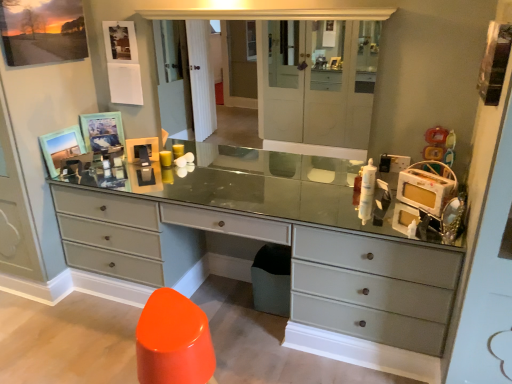
Question: Is plastic yellow toy at upper right with wooden picture frame at upper left, which is the second picture frame from top to bottom?

Choices:
 (A) no
 (B) yes

Answer: (A)

Question: Considering the relative sizes of plastic yellow toy at upper right and wooden picture frame at upper left, which is the second picture frame from top to bottom, in the image provided, is plastic yellow toy at upper right smaller than wooden picture frame at upper left, which is the second picture frame from top to bottom,?

Choices:
 (A) no
 (B) yes

Answer: (A)

Question: Considering the relative positions of plastic yellow toy at upper right and wooden picture frame at upper left, marked as the second picture frame in a bottom-to-top arrangement, in the image provided, is plastic yellow toy at upper right behind wooden picture frame at upper left, marked as the second picture frame in a bottom-to-top arrangement,?

Choices:
 (A) no
 (B) yes

Answer: (A)

Question: From a real-world perspective, is plastic yellow toy at upper right positioned over wooden picture frame at upper left, which is the second picture frame from top to bottom, based on gravity?

Choices:
 (A) no
 (B) yes

Answer: (B)

Question: Considering the relative sizes of plastic yellow toy at upper right and wooden picture frame at upper left, marked as the second picture frame in a bottom-to-top arrangement, in the image provided, is plastic yellow toy at upper right bigger than wooden picture frame at upper left, marked as the second picture frame in a bottom-to-top arrangement,?

Choices:
 (A) no
 (B) yes

Answer: (B)

Question: Is wooden picture frame at upper left, marked as the second picture frame in a bottom-to-top arrangement, located within plastic yellow toy at upper right?

Choices:
 (A) yes
 (B) no

Answer: (B)

Question: Is matte glass medicine cabinet at center surrounding matte wooden picture frame at upper left, which is counted as the 3th picture frame, starting from the bottom?

Choices:
 (A) yes
 (B) no

Answer: (B)

Question: From the image's perspective, is matte glass medicine cabinet at center over matte wooden picture frame at upper left, which is the first picture frame in top-to-bottom order?

Choices:
 (A) no
 (B) yes

Answer: (A)

Question: Is matte glass medicine cabinet at center looking in the opposite direction of matte wooden picture frame at upper left, which is counted as the 3th picture frame, starting from the bottom?

Choices:
 (A) yes
 (B) no

Answer: (B)

Question: Considering the relative sizes of matte glass medicine cabinet at center and matte wooden picture frame at upper left, which is the first picture frame in top-to-bottom order, in the image provided, is matte glass medicine cabinet at center thinner than matte wooden picture frame at upper left, which is the first picture frame in top-to-bottom order,?

Choices:
 (A) no
 (B) yes

Answer: (A)

Question: From the image's perspective, does matte glass medicine cabinet at center appear lower than matte wooden picture frame at upper left, which is counted as the 3th picture frame, starting from the bottom?

Choices:
 (A) no
 (B) yes

Answer: (B)

Question: Can you confirm if matte glass medicine cabinet at center is wider than matte wooden picture frame at upper left, which is the first picture frame in top-to-bottom order?

Choices:
 (A) yes
 (B) no

Answer: (A)

Question: From the image's perspective, is matte wooden picture frame at upper left, which is the third picture frame from top to bottom, on matte wooden picture frame at upper left, which is the first picture frame in top-to-bottom order?

Choices:
 (A) no
 (B) yes

Answer: (A)